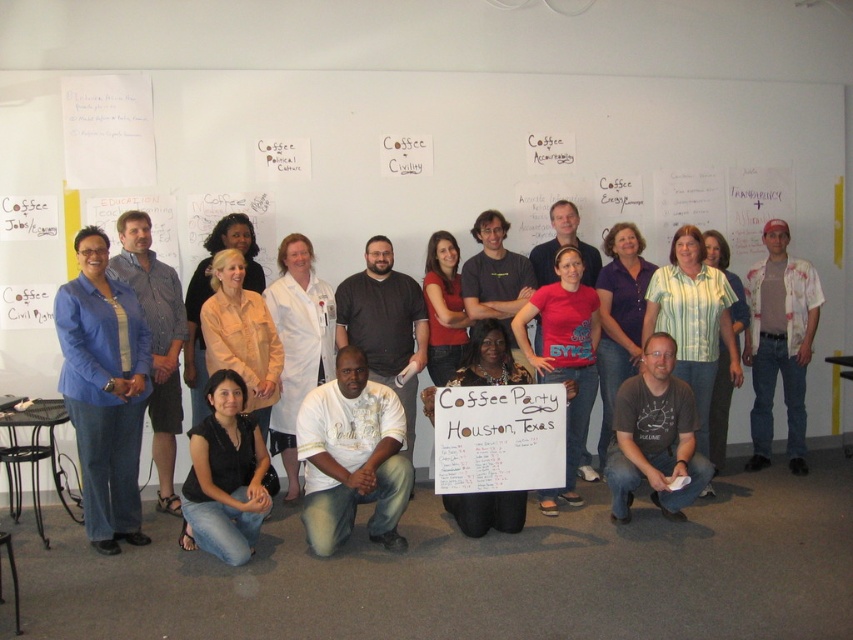
Question: Which object is farther from the camera taking this photo?

Choices:
 (A) white painted shirt at right
 (B) white lab coat at center

Answer: (A)

Question: Which point is closer to the camera?

Choices:
 (A) click(x=782, y=330)
 (B) click(x=148, y=397)

Answer: (B)

Question: Considering the real-world distances, which object is closest to the blue fabric shirt at left?

Choices:
 (A) blue striped shirt at left
 (B) white lab coat at center
 (C) white painted shirt at right

Answer: (A)

Question: Can you confirm if blue fabric shirt at left is smaller than blue striped shirt at left?

Choices:
 (A) yes
 (B) no

Answer: (B)

Question: Observing the image, what is the correct spatial positioning of blue fabric shirt at left in reference to white painted shirt at right?

Choices:
 (A) below
 (B) above

Answer: (A)

Question: Can you confirm if black denim jeans at lower left is positioned to the left of white lab coat at center?

Choices:
 (A) no
 (B) yes

Answer: (B)